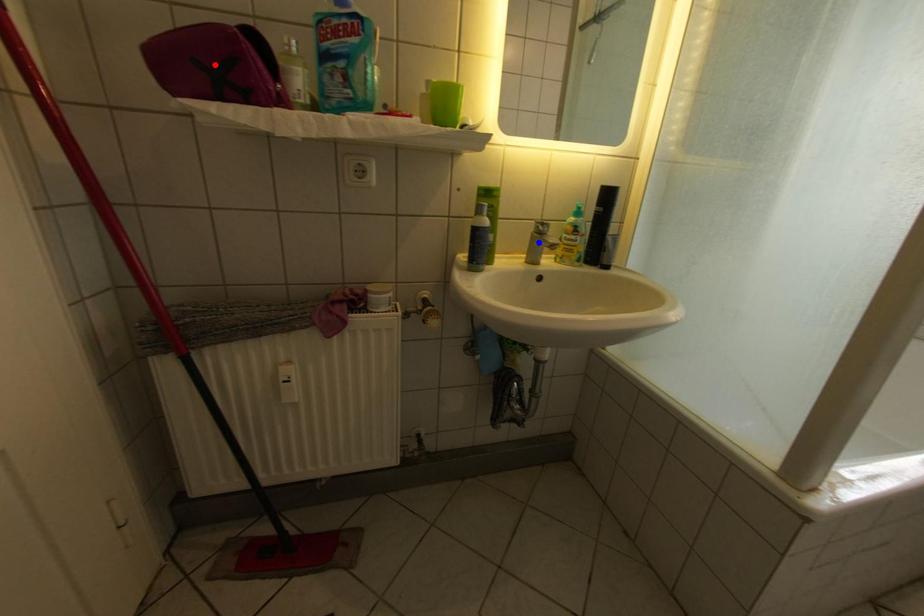
Question: Which of the two points in the image is closer to the camera?

Choices:
 (A) Blue point is closer.
 (B) Red point is closer.

Answer: (B)